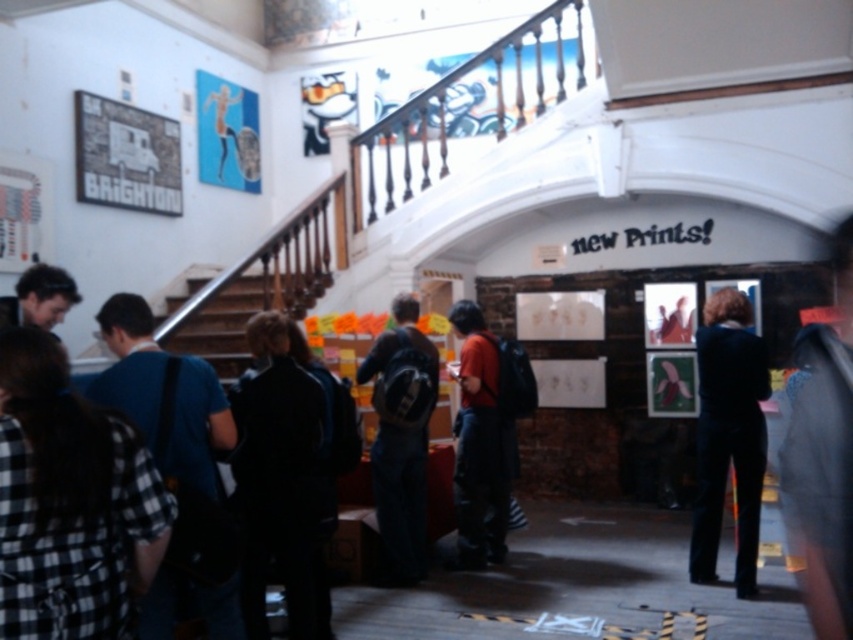
You are a visitor at the exhibition and want to pick up both the black fabric jacket at center and the dark blue backpack at center from the table. Can you reach both items without moving from your current position?

The black fabric jacket at center is 2.09 meters away from the dark blue backpack at center. Since the distance between them is quite large, you would likely need to move your position to reach both items.

You are an art enthusiast standing in the gallery and see the black fabric jacket at center and the metallic staircase at center. Which object is positioned to the right side from your viewpoint?

The black fabric jacket at center is positioned to the right of the metallic staircase at center, so the black fabric jacket at center is on the right side.